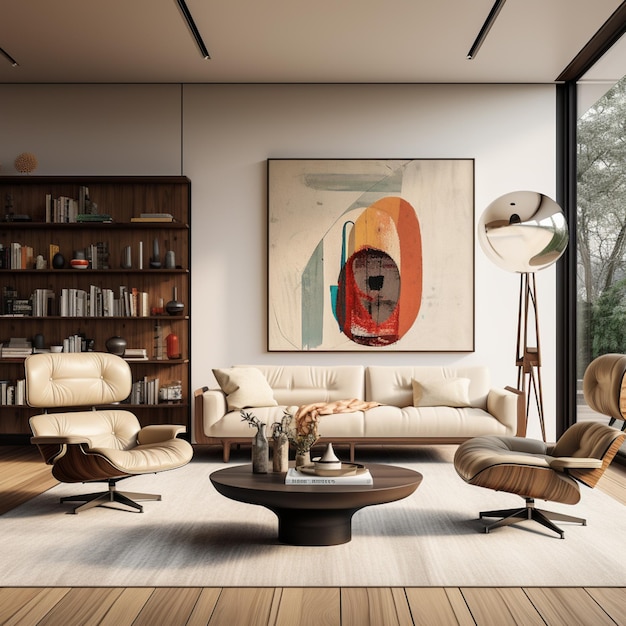
The image size is (626, 626). Identify the location of ceiling. (293, 53).